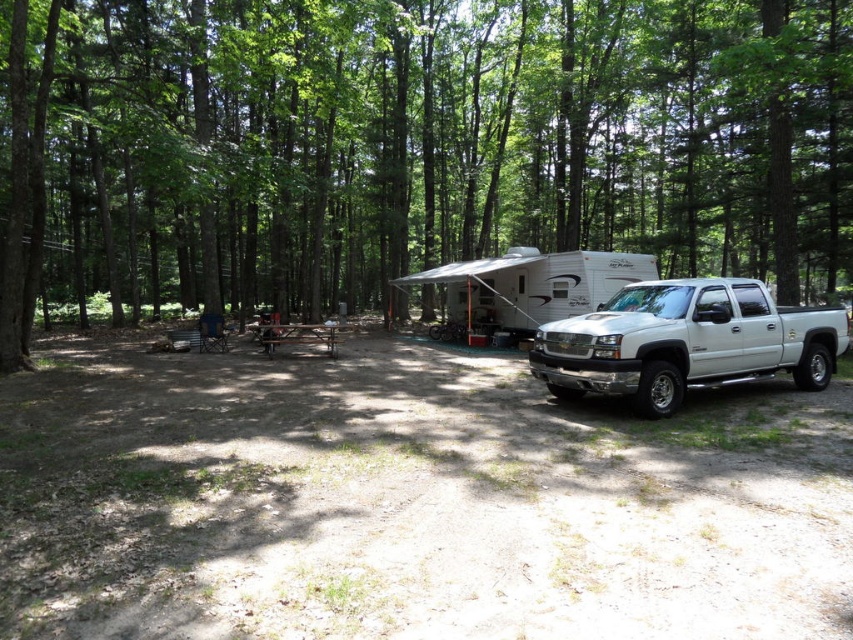
You are standing at the center of the image and want to move towards the white metallic pickup truck at right. According to the coordinate system where the bottom left corner is the origin, what direction should you move in?

Since the white metallic pickup truck at right is located at coordinate point 0.536 on the x axis and 0.804 on the y axis, you should move towards the right and upwards to reach it.

You are a hiker who wants to take a photo of the green leafy tree at center. Where should you stand to get the best view of it?

The green leafy tree at center is located at point 0.233 on the x axis and 0.481 on the y axis. To get the best view, you should position yourself facing the tree from a distance that allows you to capture its full height and spread without obstruction.